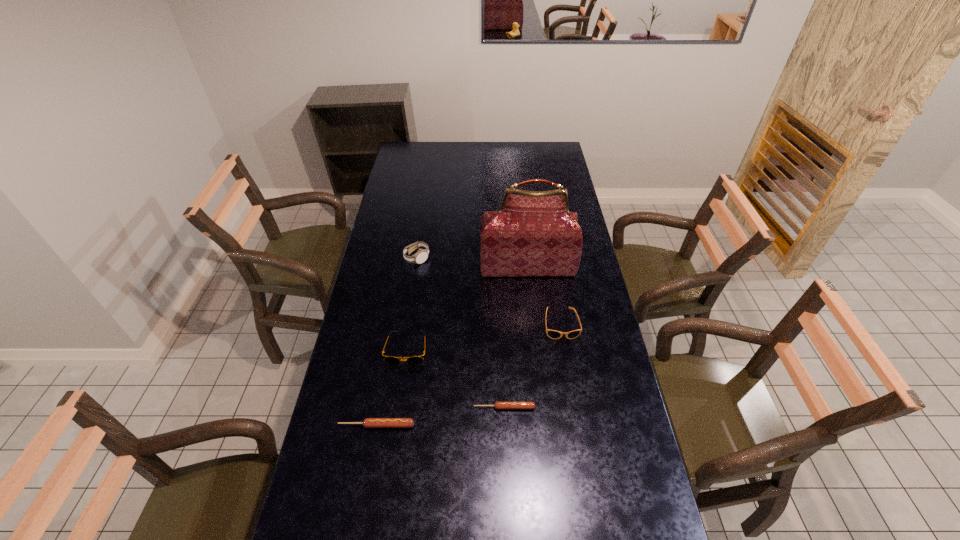
You are a GUI agent. You are given a task and a screenshot of the screen. Output one action in this format:
    pyautogui.click(x=<x>, y=<y>)
    Task: Click on the free point that keeps the sausages evenly spaced on the right
    The height and width of the screenshot is (540, 960).
    Given the screenshot: What is the action you would take?
    pyautogui.click(x=625, y=390)